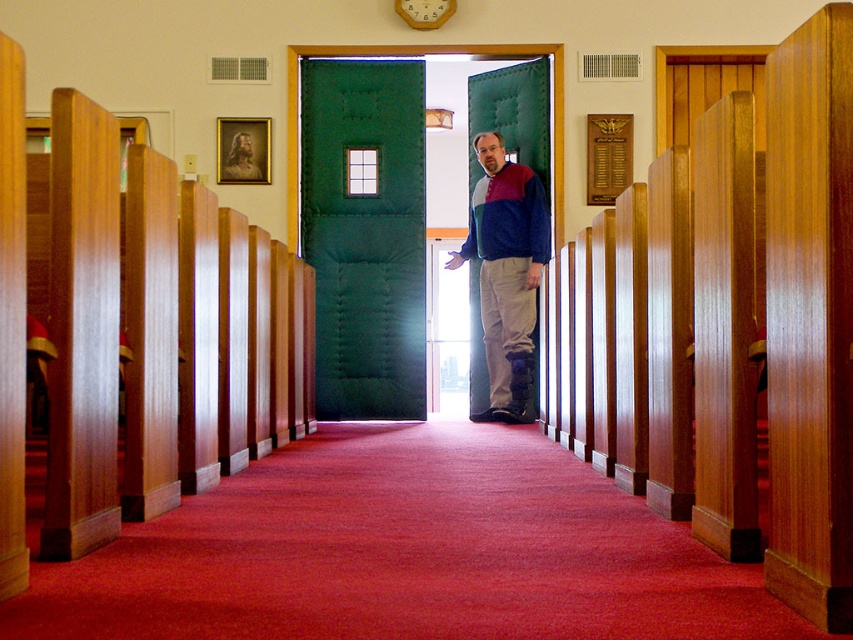
Question: Is carpeted aisle at center thinner than wooden clock at upper center?

Choices:
 (A) yes
 (B) no

Answer: (B)

Question: Which point appears closest to the camera in this image?

Choices:
 (A) (444, 20)
 (B) (376, 564)
 (C) (494, 221)

Answer: (B)

Question: Can you confirm if carpeted aisle at center is positioned above wooden clock at upper center?

Choices:
 (A) yes
 (B) no

Answer: (B)

Question: Based on their relative distances, which object is farther from the carpeted aisle at center?

Choices:
 (A) matte blue sweater at center
 (B) wooden clock at upper center

Answer: (B)

Question: In this image, where is carpeted aisle at center located relative to matte blue sweater at center?

Choices:
 (A) left
 (B) right

Answer: (A)

Question: Estimate the real-world distances between objects in this image. Which object is closer to the wooden clock at upper center?

Choices:
 (A) matte blue sweater at center
 (B) carpeted aisle at center

Answer: (A)